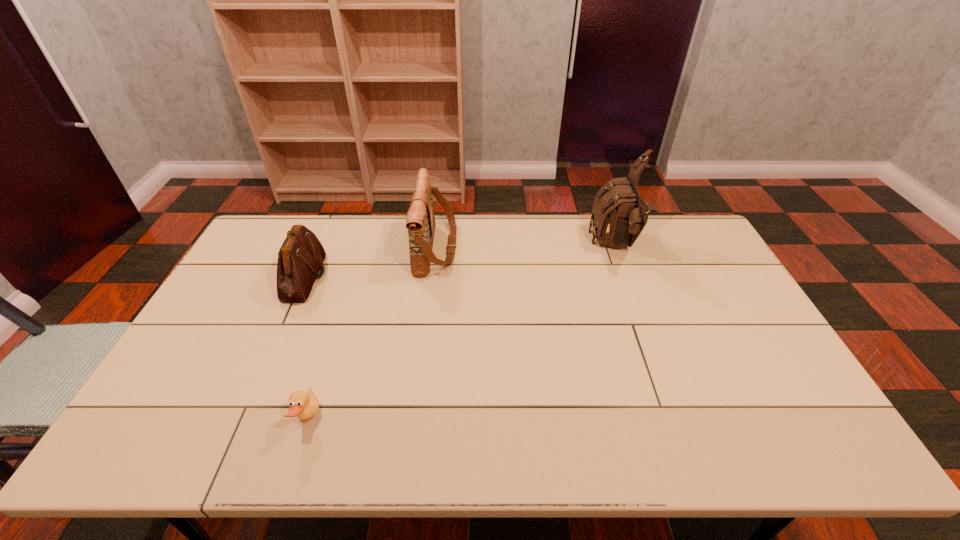
Where is `vacant space at the far right corner of the desktop`? This screenshot has width=960, height=540. vacant space at the far right corner of the desktop is located at coordinates (652, 214).

At what (x,y) coordinates should I click in order to perform the action: click on vacant space that is in between the shortest object and the third tallest object. Please return your answer as a coordinate pair (x, y). The image size is (960, 540). Looking at the image, I should click on (306, 348).

You are a GUI agent. You are given a task and a screenshot of the screen. Output one action in this format:
    pyautogui.click(x=<x>, y=<y>)
    Task: Click on the vacant point located between the leftmost shoulder bag and the tallest object
    
    Given the screenshot: What is the action you would take?
    pyautogui.click(x=461, y=262)

You are a GUI agent. You are given a task and a screenshot of the screen. Output one action in this format:
    pyautogui.click(x=<x>, y=<y>)
    Task: Click on the blank region between the duck and the tallest object
    The height and width of the screenshot is (540, 960).
    Given the screenshot: What is the action you would take?
    pyautogui.click(x=462, y=332)

At what (x,y) coordinates should I click in order to perform the action: click on free space between the second shortest shoulder bag and the second shortest object. Please return your answer as a coordinate pair (x, y). Looking at the image, I should click on (371, 263).

Locate an element on the screen. The height and width of the screenshot is (540, 960). blank region between the rightmost shoulder bag and the shortest object is located at coordinates (462, 332).

Identify the location of vacant point located between the leftmost shoulder bag and the shortest object. (306, 348).

I want to click on vacant space that's between the second shoulder bag from left to right and the tallest shoulder bag, so click(526, 247).

Where is `vacant point located between the second tallest shoulder bag and the duck`? The image size is (960, 540). vacant point located between the second tallest shoulder bag and the duck is located at coordinates (372, 333).

You are a GUI agent. You are given a task and a screenshot of the screen. Output one action in this format:
    pyautogui.click(x=<x>, y=<y>)
    Task: Click on the vacant area between the tallest object and the duck
    This screenshot has width=960, height=540.
    Given the screenshot: What is the action you would take?
    pyautogui.click(x=462, y=332)